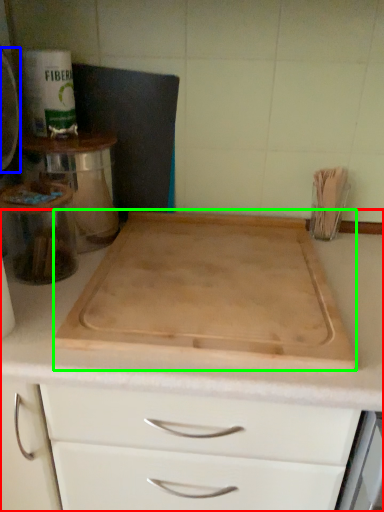
Question: Which is farther away from countertop (highlighted by a red box)? appliance (highlighted by a blue box) or cutting board (highlighted by a green box)?

Choices:
 (A) appliance
 (B) cutting board

Answer: (A)